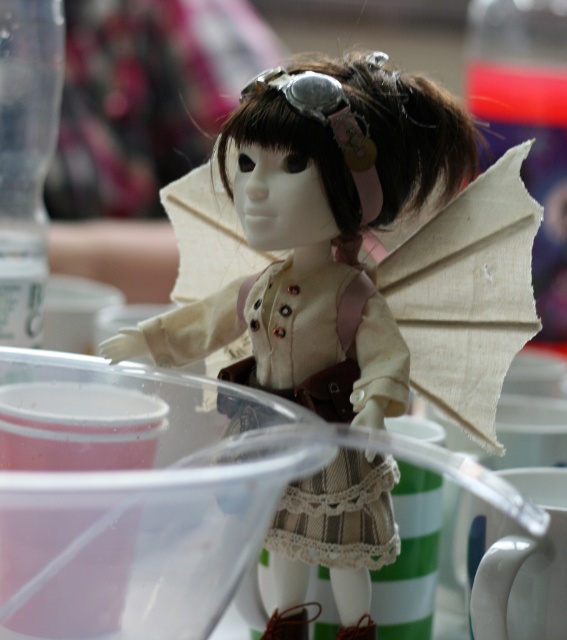
Question: Which of the following is the closest to the observer?

Choices:
 (A) white ceramic mug at lower right
 (B) striped cotton dress at center
 (C) beige fabric wings at center

Answer: (B)

Question: Which point is closer to the camera?

Choices:
 (A) (490, 344)
 (B) (472, 621)

Answer: (A)

Question: Where is striped cotton dress at center located in relation to white ceramic mug at lower right in the image?

Choices:
 (A) right
 (B) left

Answer: (B)

Question: Which point is closer to the camera taking this photo?

Choices:
 (A) (401, 634)
 (B) (361, 365)

Answer: (B)

Question: Does matte beige doll at center have a larger size compared to white ceramic mug at lower right?

Choices:
 (A) yes
 (B) no

Answer: (A)

Question: Can you confirm if beige fabric wings at center is wider than white ceramic mug at lower right?

Choices:
 (A) yes
 (B) no

Answer: (A)